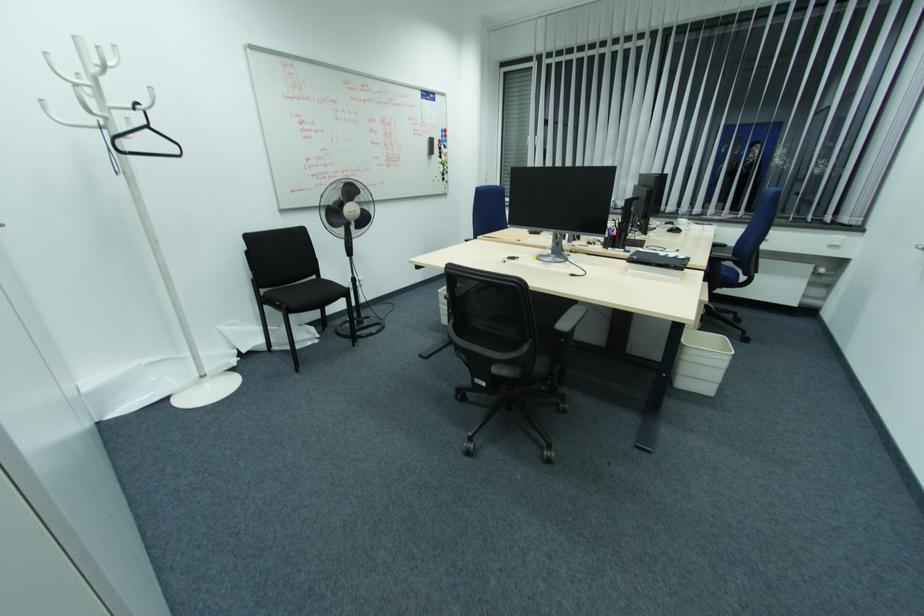
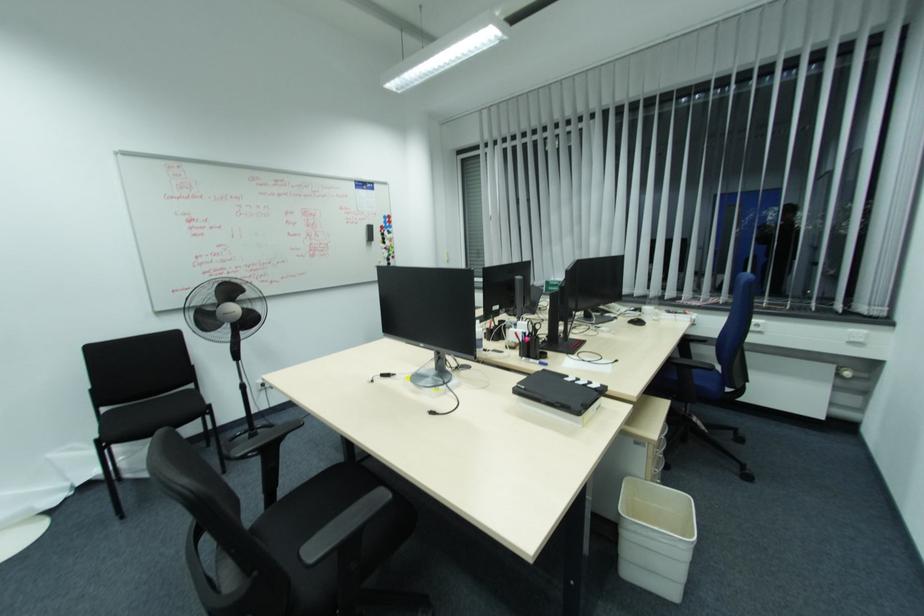
Which direction would the cameraman need to move to produce the second image?

The cameraman walked toward right, forward.